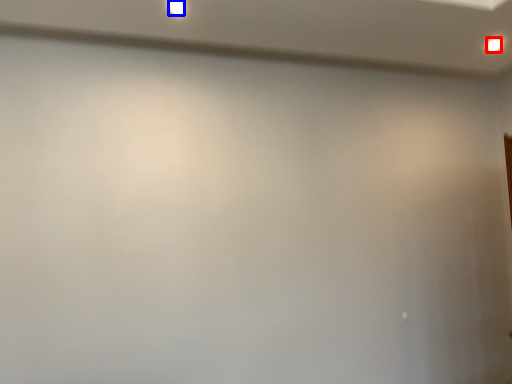
Question: Which point is closer to the camera, light (highlighted by a red box) or light (highlighted by a blue box)?

Choices:
 (A) light
 (B) light

Answer: (B)